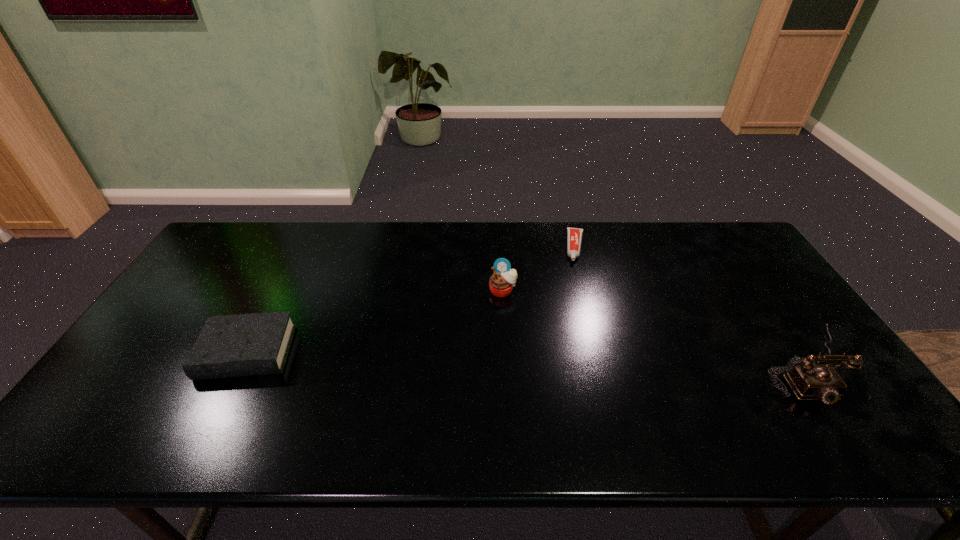
Where is `free space that is in between the muffin and the shortest object`? free space that is in between the muffin and the shortest object is located at coordinates (540, 269).

Where is `empty space that is in between the rightmost object and the third tallest object`? This screenshot has height=540, width=960. empty space that is in between the rightmost object and the third tallest object is located at coordinates (526, 359).

Find the location of a particular element. The width and height of the screenshot is (960, 540). vacant space that's between the Bible and the third object from right to left is located at coordinates (375, 322).

The width and height of the screenshot is (960, 540). What are the coordinates of `empty space that is in between the telephone and the third tallest object` in the screenshot? It's located at pos(526,359).

Find the location of a particular element. The image size is (960, 540). object that can be found as the closest to the muffin is located at coordinates (574, 235).

At what (x,y) coordinates should I click in order to perform the action: click on the third closest object to the third tallest object. Please return your answer as a coordinate pair (x, y). Looking at the image, I should click on (809, 381).